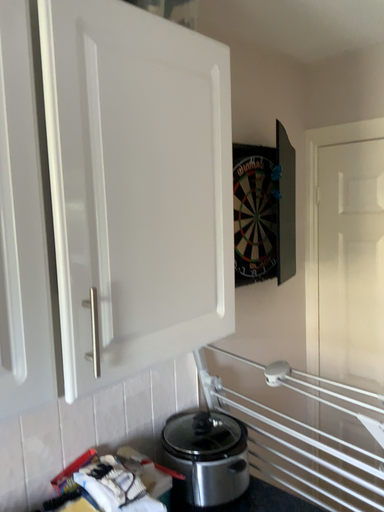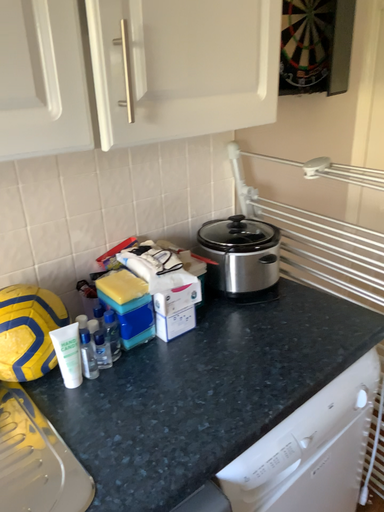
Question: Which way did the camera rotate in the video?

Choices:
 (A) rotated upward
 (B) rotated downward

Answer: (B)